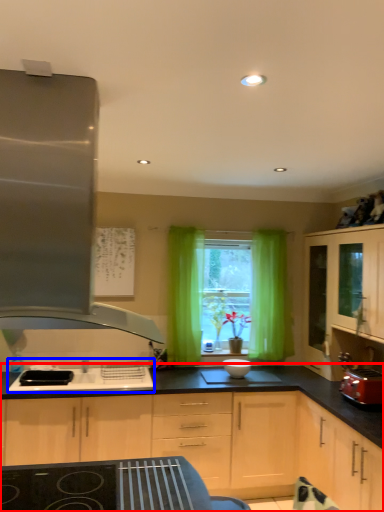
Question: Which of the following is the farthest to the observer, cabinetry (highlighted by a red box) or sink (highlighted by a blue box)?

Choices:
 (A) cabinetry
 (B) sink

Answer: (B)